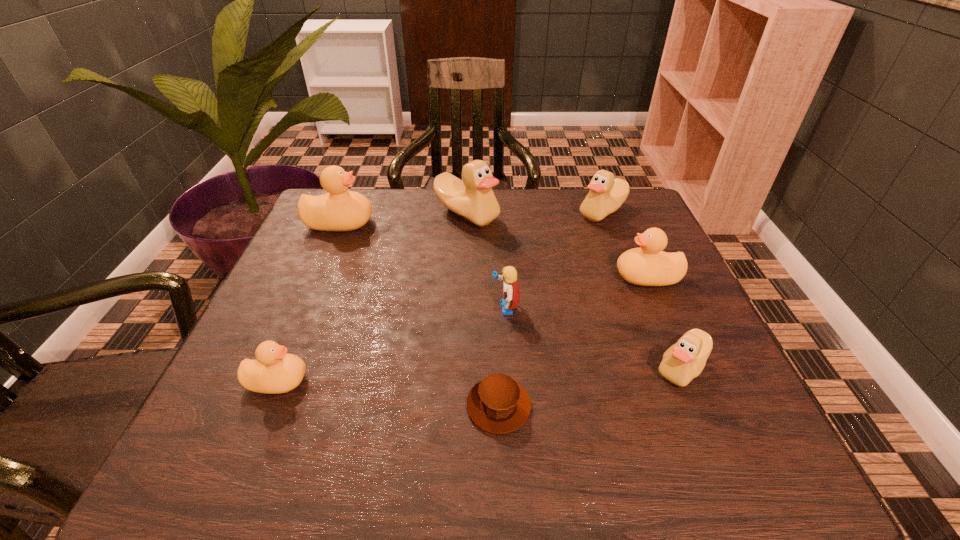
The width and height of the screenshot is (960, 540). Identify the location of the leftmost beige duck. (472, 198).

The image size is (960, 540). Identify the location of the third duck from left to right. (472, 198).

I want to click on the biggest yellow duck, so click(338, 210).

The height and width of the screenshot is (540, 960). Find the location of `the second smallest beige duck`. the second smallest beige duck is located at coordinates (607, 194).

In order to click on the second nearest yellow duck in this screenshot , I will do `click(647, 266)`.

Locate an element on the screen. This screenshot has width=960, height=540. the fifth nearest object is located at coordinates 647,266.

Find the location of `Lego`. Lego is located at coordinates (511, 293).

Identify the location of the smallest beige duck. This screenshot has width=960, height=540. (682, 362).

What are the coordinates of `the nearest yellow duck` in the screenshot? It's located at (274, 371).

Where is `brown muffin`? The width and height of the screenshot is (960, 540). brown muffin is located at coordinates (497, 404).